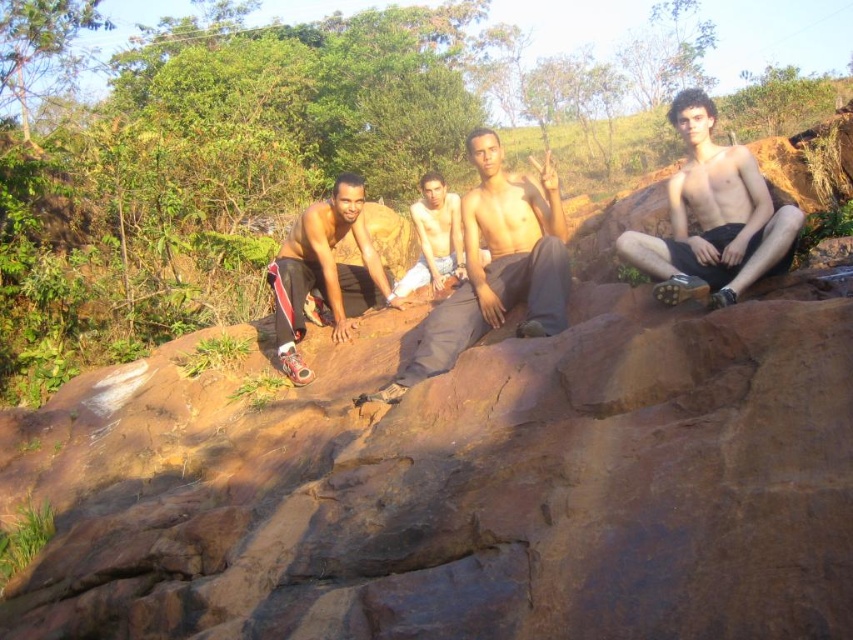
Does brown rough rock at center have a greater height compared to shiny black shorts at right?

Yes.

Is brown rough rock at center bigger than shiny black shorts at right?

Indeed, brown rough rock at center has a larger size compared to shiny black shorts at right.

Which is behind, point (82, 513) or point (688, 156)?

The point (688, 156) is more distant.

Find the location of `brown rough rock at center`. brown rough rock at center is located at coordinates (456, 484).

How much distance is there between brown rough rock at center and shiny black shorts at left?

brown rough rock at center is 1.02 meters away from shiny black shorts at left.

In the scene shown: Is brown rough rock at center to the right of shiny black shorts at left from the viewer's perspective?

Incorrect, brown rough rock at center is not on the right side of shiny black shorts at left.

You are a GUI agent. You are given a task and a screenshot of the screen. Output one action in this format:
    pyautogui.click(x=<x>, y=<y>)
    Task: Click on the brown rough rock at center
    
    Given the screenshot: What is the action you would take?
    pyautogui.click(x=456, y=484)

The width and height of the screenshot is (853, 640). Describe the element at coordinates (494, 266) in the screenshot. I see `shiny skin at center` at that location.

How distant is shiny skin at center from shiny black shorts at left?

The distance of shiny skin at center from shiny black shorts at left is 33.85 inches.

The height and width of the screenshot is (640, 853). I want to click on shiny skin at center, so click(494, 266).